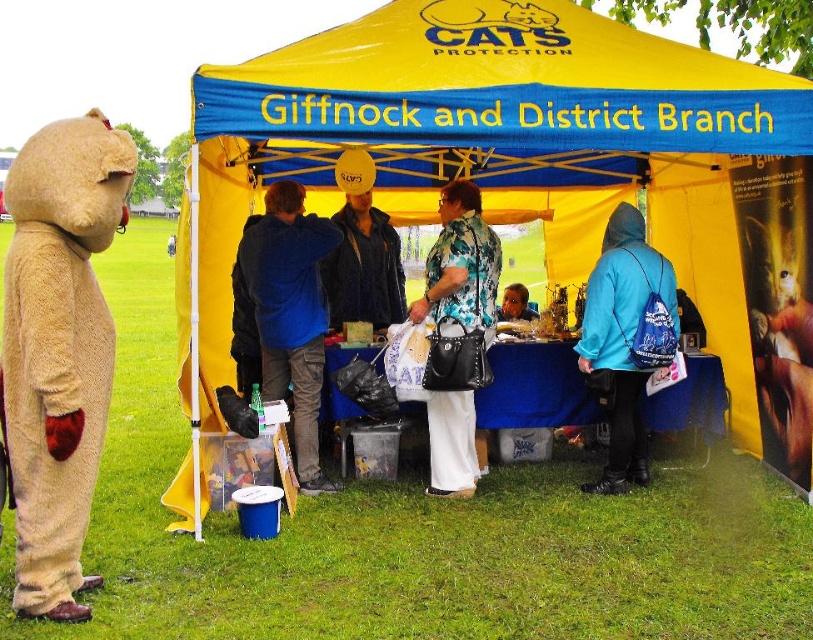
Question: Is the position of blue denim jacket at center more distant than that of smooth skin face at center?

Choices:
 (A) no
 (B) yes

Answer: (A)

Question: Which object is closer to the camera taking this photo?

Choices:
 (A) blue cotton shirt at center
 (B) floral fabric blouse at center
 (C) blue fabric backpack at lower right

Answer: (C)

Question: Which point is closer to the camera?

Choices:
 (A) (433, 429)
 (B) (290, 332)
 (C) (633, 381)
 (D) (387, 273)

Answer: (C)

Question: Does yellow fabric tent at center have a greater width compared to floral fabric blouse at center?

Choices:
 (A) no
 (B) yes

Answer: (B)

Question: Which of these objects is positioned closest to the yellow fabric tent at center?

Choices:
 (A) blue fabric backpack at lower right
 (B) blue denim jacket at center
 (C) floral fabric blouse at center

Answer: (C)

Question: Can you confirm if yellow fabric tent at center is positioned below fuzzy beige bear at left?

Choices:
 (A) yes
 (B) no

Answer: (B)